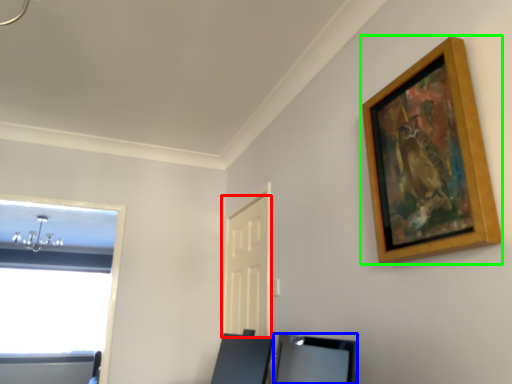
Question: Which is nearer to the door (highlighted by a red box)? vanity (highlighted by a blue box) or picture frame (highlighted by a green box).

Choices:
 (A) vanity
 (B) picture frame

Answer: (A)